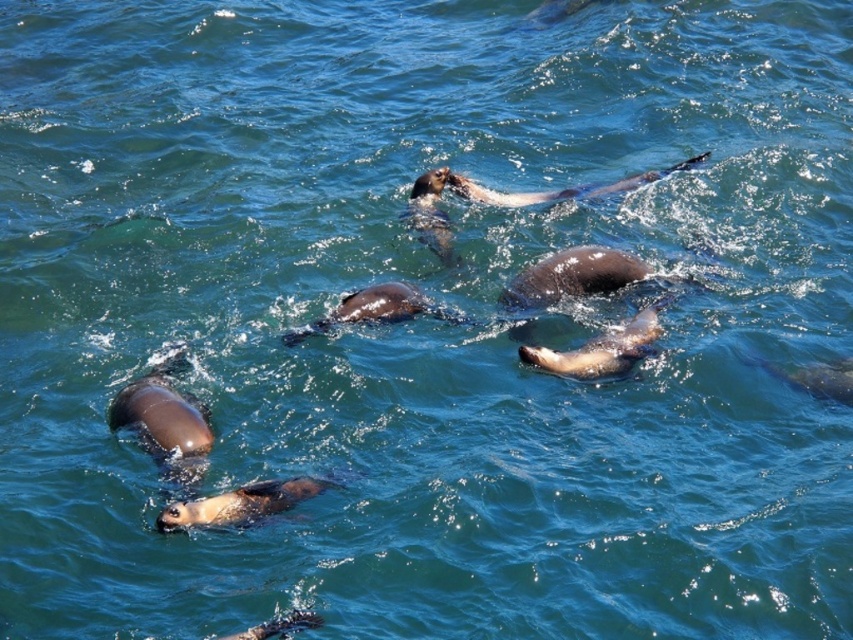
Consider the image. You are observing two brown fur seals in the water. Which seal, the brown fur seal at center or the brown fur seal at upper center, takes up more space in the image?

The brown fur seal at upper center takes up more space in the image because it occupies more space than the brown fur seal at center.

You are a marine biologist observing two brown fur seals in the ocean. You notice the brown fur seal at center and the brown fur seal at upper center. Which seal is wider?

The brown fur seal at upper center is wider than the brown fur seal at center.